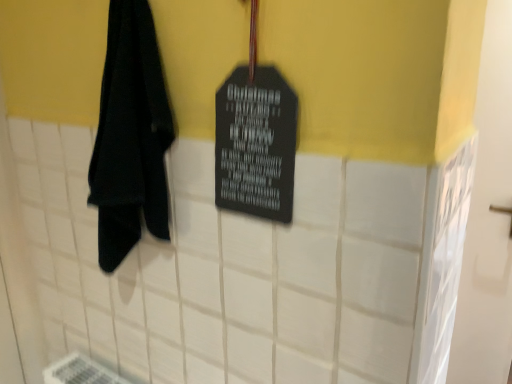
This screenshot has width=512, height=384. What do you see at coordinates (256, 144) in the screenshot?
I see `black matte tag at center` at bounding box center [256, 144].

At what (x,y) coordinates should I click in order to perform the action: click on black matte tag at center. Please return your answer as a coordinate pair (x, y). This screenshot has width=512, height=384. Looking at the image, I should click on (256, 144).

Find the location of a particular element. The width and height of the screenshot is (512, 384). black matte tag at center is located at coordinates point(256,144).